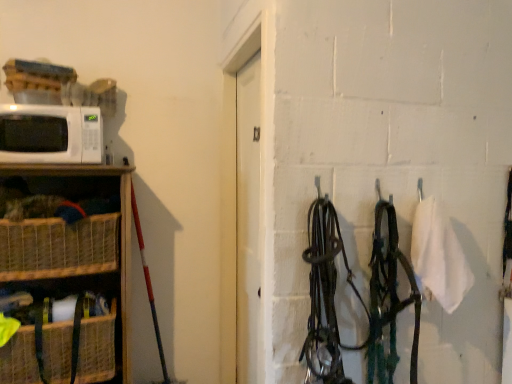
Question: In terms of height, does woven brown basket at lower left, the 1th basket from the bottom, look taller or shorter compared to woven wood shelf at left?

Choices:
 (A) short
 (B) tall

Answer: (A)

Question: Relative to woven wood shelf at left, is woven brown basket at lower left, the 2th basket viewed from the top, in front or behind?

Choices:
 (A) behind
 (B) front

Answer: (A)

Question: Which is nearer to the woven brown basket at left, the second basket when ordered from bottom to top?

Choices:
 (A) woven brown basket at lower left, the 1th basket from the bottom
 (B) woven wood shelf at left
 (C) white matte microwave at left

Answer: (B)

Question: Which object is the closest to the white matte microwave at left?

Choices:
 (A) woven wood shelf at left
 (B) woven brown basket at left, the second basket when ordered from bottom to top
 (C) woven brown basket at lower left, the 1th basket from the bottom

Answer: (A)